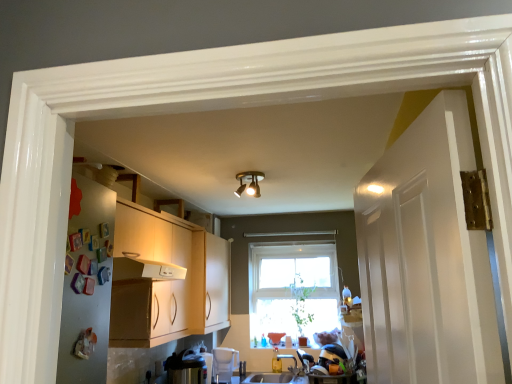
Where is `gold metallic light fixture at center`? gold metallic light fixture at center is located at coordinates (249, 184).

The height and width of the screenshot is (384, 512). Describe the element at coordinates (293, 378) in the screenshot. I see `smooth white countertop at lower center` at that location.

Find the location of a particular element. The image size is (512, 384). satin silver toaster at lower left, marked as the 1th appliance in a left-to-right arrangement is located at coordinates click(186, 368).

Based on the photo, what is the approximate width of matte wood cabinet at center?

matte wood cabinet at center is 16.66 inches in width.

Find the location of a particular element. This screenshot has width=512, height=384. white plastic water filter at lower center, positioned as the 2th appliance in front-to-back order is located at coordinates (224, 364).

Between point (332, 328) and point (204, 376), which one is positioned behind?

The point (332, 328) is behind.

Is clear glass window at center positioned with its back to satin silver toaster at lower left, which is the 2th appliance from back to front?

That's not correct — clear glass window at center is not looking away from satin silver toaster at lower left, which is the 2th appliance from back to front.

From a real-world perspective, which is physically below, clear glass window at center or satin silver toaster at lower left, which is the 2th appliance from back to front?

satin silver toaster at lower left, which is the 2th appliance from back to front, is physically lower.

Considering their positions, is satin silver toaster at lower left, arranged as the second appliance when viewed from the right, located in front of or behind matte wood cabinet at center?

In the image, satin silver toaster at lower left, arranged as the second appliance when viewed from the right, appears in front of matte wood cabinet at center.

From a real-world perspective, is satin silver toaster at lower left, which is the 2th appliance from back to front, positioned under matte wood cabinet at center based on gravity?

Yes, from a real-world perspective, satin silver toaster at lower left, which is the 2th appliance from back to front, is below matte wood cabinet at center.

Can you confirm if satin silver toaster at lower left, arranged as the second appliance when viewed from the right, is shorter than matte wood cabinet at center?

Yes.

Considering the sizes of objects satin silver toaster at lower left, arranged as the second appliance when viewed from the right, and matte wood cabinet at center in the image provided, who is wider, satin silver toaster at lower left, arranged as the second appliance when viewed from the right, or matte wood cabinet at center?

matte wood cabinet at center is wider.

Considering the relative sizes of white plastic water filter at lower center, the second appliance in the left-to-right sequence, and matte wood cabinet at center in the image provided, is white plastic water filter at lower center, the second appliance in the left-to-right sequence, taller than matte wood cabinet at center?

Incorrect, the height of white plastic water filter at lower center, the second appliance in the left-to-right sequence, is not larger of that of matte wood cabinet at center.

This screenshot has width=512, height=384. In order to click on cabinetry above the white plastic water filter at lower center, placed as the 1th appliance when sorted from back to front (from the image's perspective) in this screenshot , I will do `click(209, 283)`.

Are white plastic water filter at lower center, placed as the 1th appliance when sorted from back to front, and matte wood cabinet at center far apart?

No, there isn't a large distance between white plastic water filter at lower center, placed as the 1th appliance when sorted from back to front, and matte wood cabinet at center.

Measure the distance from white plastic water filter at lower center, positioned as the 2th appliance in front-to-back order, to matte wood cabinet at center.

white plastic water filter at lower center, positioned as the 2th appliance in front-to-back order, is 24.30 inches away from matte wood cabinet at center.

Is white plastic water filter at lower center, placed as the 1th appliance when sorted from back to front, shorter than smooth white countertop at lower center?

In fact, white plastic water filter at lower center, placed as the 1th appliance when sorted from back to front, may be taller than smooth white countertop at lower center.

Could you tell me if white plastic water filter at lower center, the first appliance in the right-to-left sequence, is facing smooth white countertop at lower center?

No.

Considering the sizes of white plastic water filter at lower center, the second appliance in the left-to-right sequence, and smooth white countertop at lower center in the image, is white plastic water filter at lower center, the second appliance in the left-to-right sequence, wider or thinner than smooth white countertop at lower center?

white plastic water filter at lower center, the second appliance in the left-to-right sequence, is thinner than smooth white countertop at lower center.

Is white plastic water filter at lower center, positioned as the 2th appliance in front-to-back order, bigger or smaller than clear glass window at center?

Clearly, white plastic water filter at lower center, positioned as the 2th appliance in front-to-back order, is smaller in size than clear glass window at center.

From the picture: Which object is closer to the camera, white plastic water filter at lower center, positioned as the 2th appliance in front-to-back order, or clear glass window at center?

white plastic water filter at lower center, positioned as the 2th appliance in front-to-back order, is in front.

From the image's perspective, is white plastic water filter at lower center, placed as the 1th appliance when sorted from back to front, above or below clear glass window at center?

Clearly, from the image's perspective, white plastic water filter at lower center, placed as the 1th appliance when sorted from back to front, is below clear glass window at center.

Can you tell me how much white plastic water filter at lower center, positioned as the 2th appliance in front-to-back order, and clear glass window at center differ in facing direction?

There is a 35.4-degree angle between the facing directions of white plastic water filter at lower center, positioned as the 2th appliance in front-to-back order, and clear glass window at center.

From a real-world perspective, relative to clear glass window at center, is smooth white countertop at lower center vertically above or below?

Clearly, from a real-world perspective, smooth white countertop at lower center is below clear glass window at center.

Which is more to the right, smooth white countertop at lower center or clear glass window at center?

Positioned to the right is smooth white countertop at lower center.

What's the angular difference between smooth white countertop at lower center and clear glass window at center's facing directions?

There is a 1.69-degree angle between the facing directions of smooth white countertop at lower center and clear glass window at center.

Is smooth white countertop at lower center positioned in front of clear glass window at center?

Yes, smooth white countertop at lower center is closer to the viewer.

This screenshot has height=384, width=512. I want to click on cabinetry above the clear glass window at center (from a real-world perspective), so click(209, 283).

Considering the points (228, 275) and (251, 321), which point is in front, point (228, 275) or point (251, 321)?

The point (251, 321) is more forward.

Is matte wood cabinet at center taller than clear glass window at center?

Incorrect, the height of matte wood cabinet at center is not larger of that of clear glass window at center.

Identify the location of window on the right of satin silver toaster at lower left, which is the 2th appliance from back to front. The height and width of the screenshot is (384, 512). (293, 289).

Find the location of a particular element. Image resolution: width=512 pixels, height=384 pixels. cabinetry behind the satin silver toaster at lower left, which is the 2th appliance from back to front is located at coordinates (209, 283).

From the image, which object appears to be nearer to satin silver toaster at lower left, marked as the 1th appliance in a left-to-right arrangement, gold metallic light fixture at center or smooth white countertop at lower center?

smooth white countertop at lower center.

Based on the photo, based on their spatial positions, is white plastic water filter at lower center, positioned as the 2th appliance in front-to-back order, or clear glass window at center further from gold metallic light fixture at center?

white plastic water filter at lower center, positioned as the 2th appliance in front-to-back order, lies further to gold metallic light fixture at center than the other object.

From the image, which object appears to be nearer to clear glass window at center, matte wood cabinet at center or satin silver toaster at lower left, marked as the 1th appliance in a left-to-right arrangement?

matte wood cabinet at center.

Based on their spatial positions, is white plastic water filter at lower center, the first appliance in the right-to-left sequence, or smooth white countertop at lower center further from matte wood cabinet at center?

smooth white countertop at lower center.

Based on their spatial positions, is satin silver toaster at lower left, marked as the 1th appliance in a left-to-right arrangement, or smooth white countertop at lower center further from white plastic water filter at lower center, the first appliance in the right-to-left sequence?

satin silver toaster at lower left, marked as the 1th appliance in a left-to-right arrangement, lies further to white plastic water filter at lower center, the first appliance in the right-to-left sequence, than the other object.

Considering their positions, is white plastic water filter at lower center, placed as the 1th appliance when sorted from back to front, positioned closer to smooth white countertop at lower center than matte wood cabinet at center?

white plastic water filter at lower center, placed as the 1th appliance when sorted from back to front, is positioned closer to the anchor smooth white countertop at lower center.

Based on their spatial positions, is smooth white countertop at lower center or satin silver toaster at lower left, which is the 2th appliance from back to front, closer to gold metallic light fixture at center?

satin silver toaster at lower left, which is the 2th appliance from back to front, is positioned closer to the anchor gold metallic light fixture at center.

Based on their spatial positions, is white plastic water filter at lower center, positioned as the 2th appliance in front-to-back order, or satin silver toaster at lower left, arranged as the second appliance when viewed from the right, further from matte wood cabinet at center?

Based on the image, white plastic water filter at lower center, positioned as the 2th appliance in front-to-back order, appears to be further to matte wood cabinet at center.

Where is `appliance between satin silver toaster at lower left, which is the 2th appliance from back to front, and smooth white countertop at lower center`? This screenshot has height=384, width=512. appliance between satin silver toaster at lower left, which is the 2th appliance from back to front, and smooth white countertop at lower center is located at coordinates (224, 364).

Locate an element on the screen. cabinetry between gold metallic light fixture at center and smooth white countertop at lower center vertically is located at coordinates (209, 283).

Where is `cabinetry between satin silver toaster at lower left, marked as the 1th appliance in a left-to-right arrangement, and clear glass window at center from front to back`? This screenshot has height=384, width=512. cabinetry between satin silver toaster at lower left, marked as the 1th appliance in a left-to-right arrangement, and clear glass window at center from front to back is located at coordinates (209, 283).

At what (x,y) coordinates should I click in order to perform the action: click on window that lies between gold metallic light fixture at center and smooth white countertop at lower center from top to bottom. Please return your answer as a coordinate pair (x, y). The height and width of the screenshot is (384, 512). Looking at the image, I should click on (293, 289).